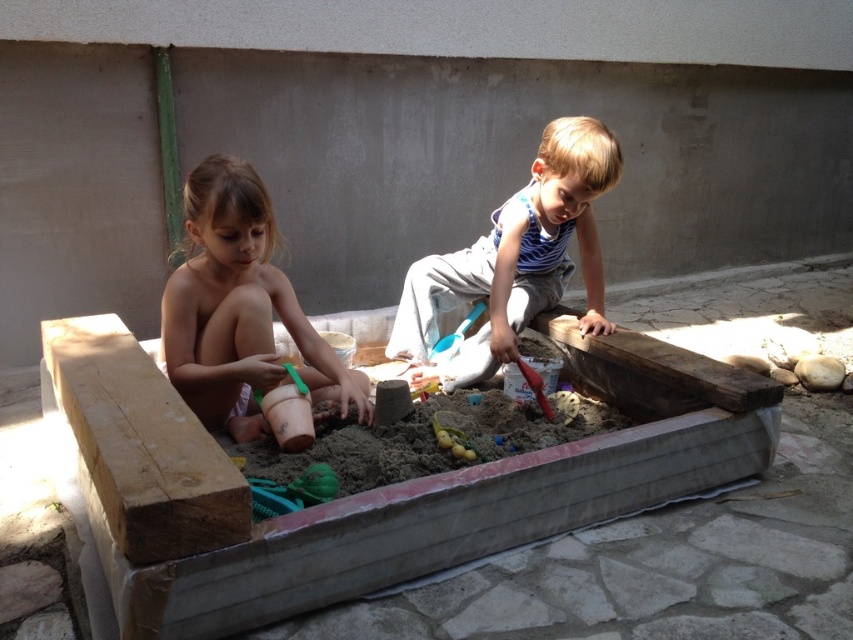
Image resolution: width=853 pixels, height=640 pixels. Describe the element at coordinates (515, 259) in the screenshot. I see `striped cotton shirt at center` at that location.

Looking at this image, who is positioned more to the right, striped cotton shirt at center or blue plastic shovel at center?

From the viewer's perspective, striped cotton shirt at center appears more on the right side.

This screenshot has height=640, width=853. Find the location of `striped cotton shirt at center`. striped cotton shirt at center is located at coordinates (515, 259).

Where is `striped cotton shirt at center`? This screenshot has width=853, height=640. striped cotton shirt at center is located at coordinates (515, 259).

Is smooth skin girl at left above blue plastic shovel at center?

Yes, smooth skin girl at left is above blue plastic shovel at center.

Which is below, smooth skin girl at left or blue plastic shovel at center?

blue plastic shovel at center

Image resolution: width=853 pixels, height=640 pixels. What do you see at coordinates (239, 308) in the screenshot?
I see `smooth skin girl at left` at bounding box center [239, 308].

The height and width of the screenshot is (640, 853). In order to click on smooth skin girl at left in this screenshot , I will do `click(239, 308)`.

Does point (245, 209) come behind point (520, 330)?

No, (245, 209) is closer to viewer.

Which is above, smooth skin girl at left or striped cotton shirt at center?

Positioned higher is striped cotton shirt at center.

Is point (332, 396) more distant than point (607, 186)?

No, it is not.

Identify the location of smooth skin girl at left. (239, 308).